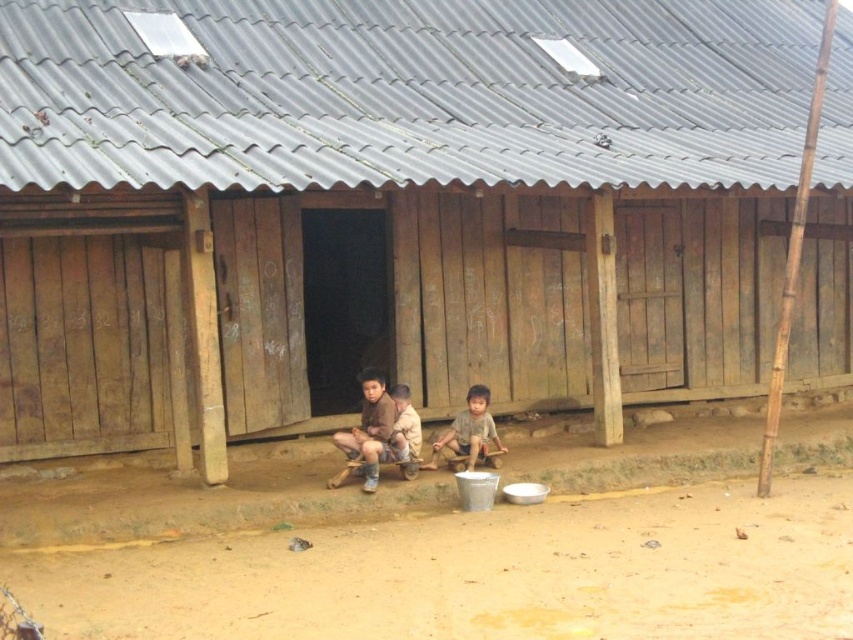
You are standing 30 feet away from the brown leather shoes at center. Can you reach them without moving closer?

The brown leather shoes at center are 31.15 feet away from the camera, so you are 1.15 feet too far to reach them without moving closer.

You are designing a play area for children and need to place two wooden figures, the brown wooden boy at center and the light brown wooden child at center, side by side on a shelf. Which of the two figures requires more space horizontally?

The light brown wooden child at center requires more horizontal space because it has a greater width than the brown wooden boy at center.

Based on the photo, you are standing in front of the rustic wooden building and notice the brown leather shoes at center. Based on their position, can you determine if they are placed closer to the building or the concrete platform?

The brown leather shoes at center are located at point coordinates that place them on the concrete platform, so they are closer to the platform than the building.